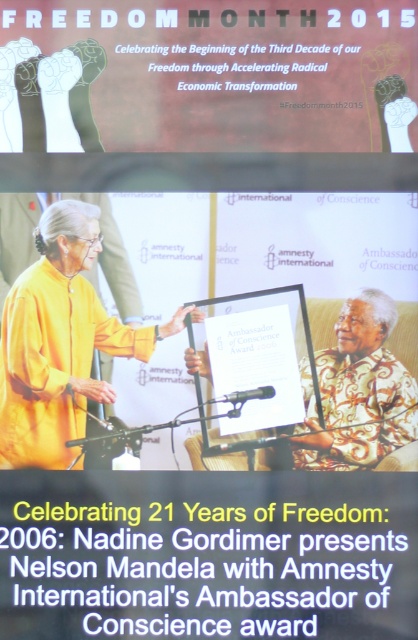
Is yellow matte dress at left thinner than white floral shirt at center?

Yes, yellow matte dress at left is thinner than white floral shirt at center.

This screenshot has width=418, height=640. Describe the element at coordinates (61, 336) in the screenshot. I see `yellow matte dress at left` at that location.

Is point (40, 406) less distant than point (338, 400)?

No, it is not.

At what (x,y) coordinates should I click in order to perform the action: click on yellow matte dress at left. Please return your answer as a coordinate pair (x, y). Looking at the image, I should click on (61, 336).

Does yellow matte dress at left have a larger size compared to black metallic microphone at center?

Correct, yellow matte dress at left is larger in size than black metallic microphone at center.

Between point (116, 250) and point (255, 397), which one is positioned behind?

Positioned behind is point (116, 250).

Identify the location of yellow matte dress at left. click(61, 336).

Is white floral shirt at center closer to the viewer compared to black metallic microphone at center?

Yes, it is in front of black metallic microphone at center.

In the scene shown: Does white floral shirt at center have a greater height compared to black metallic microphone at center?

Correct, white floral shirt at center is much taller as black metallic microphone at center.

Who is more forward, (349, 328) or (216, 401)?

Positioned in front is point (349, 328).

This screenshot has height=640, width=418. In order to click on white floral shirt at center in this screenshot , I will do `click(361, 380)`.